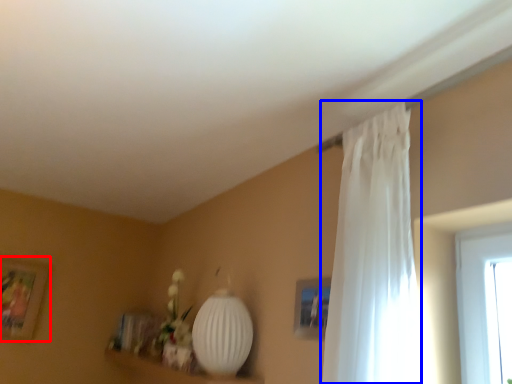
Question: Which point is closer to the camera, picture frame (highlighted by a red box) or curtain (highlighted by a blue box)?

Choices:
 (A) picture frame
 (B) curtain

Answer: (B)